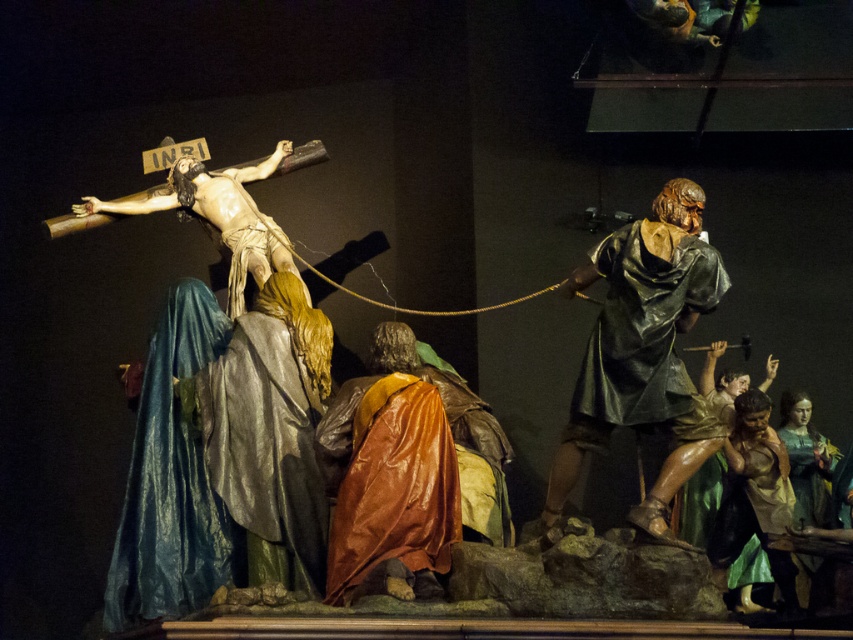
You are an art student analyzing the composition of this religious artwork. You notice the smooth wood crucifix at upper left and the smooth green fabric at lower right. Which object occupies a more prominent vertical position in the artwork?

The smooth wood crucifix at upper left is much taller as smooth green fabric at lower right, so it occupies a more prominent vertical position in the artwork.

You are an art student analyzing the composition of this religious artwork. You notice two elements in the scene, the shiny bronze helmet at right and the smooth wood crucifix at upper left. Based on their positions, which one is located to the east if the artwork is oriented with the crucifixion scene facing north?

The shiny bronze helmet at right is to the right of smooth wood crucifix at upper left. Since the artwork is oriented north, the right side would correspond to east. Therefore, the shiny bronze helmet at right is located to the east.